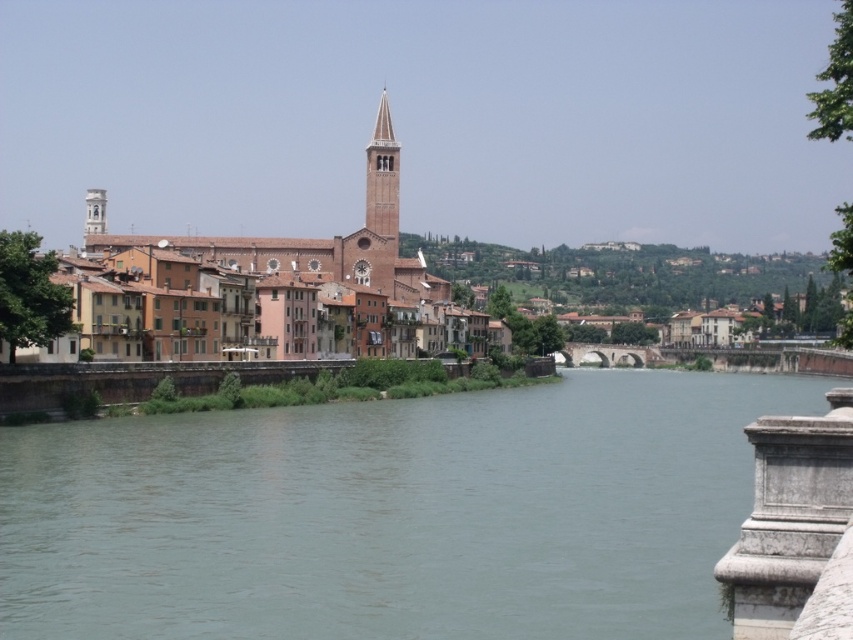
Question: Which of the following is the farthest from the observer?

Choices:
 (A) brown brick bell tower at center
 (B) smooth white tower at upper left

Answer: (B)

Question: Is brown brick town at center above brown brick bell tower at center?

Choices:
 (A) no
 (B) yes

Answer: (A)

Question: Which point is closer to the camera?

Choices:
 (A) (91, 214)
 (B) (256, 252)
 (C) (398, 196)
 (D) (676, 490)

Answer: (D)

Question: Does brown brick town at center have a greater width compared to smooth white tower at upper left?

Choices:
 (A) no
 (B) yes

Answer: (B)

Question: Is brown brick bell tower at center closer to camera compared to smooth white tower at upper left?

Choices:
 (A) yes
 (B) no

Answer: (A)

Question: Estimate the real-world distances between objects in this image. Which object is closer to the smooth white tower at upper left?

Choices:
 (A) greenish concrete river at center
 (B) brown brick town at center

Answer: (B)